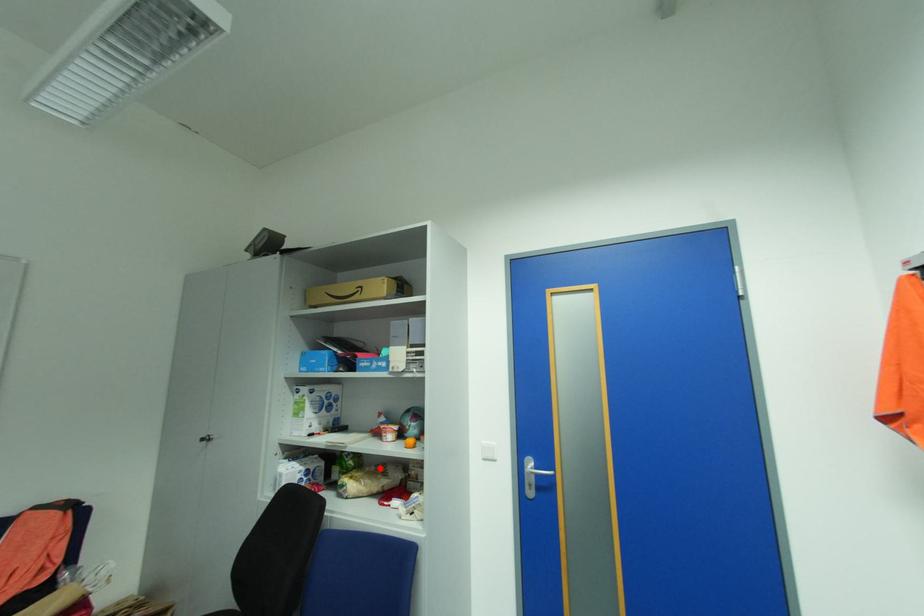
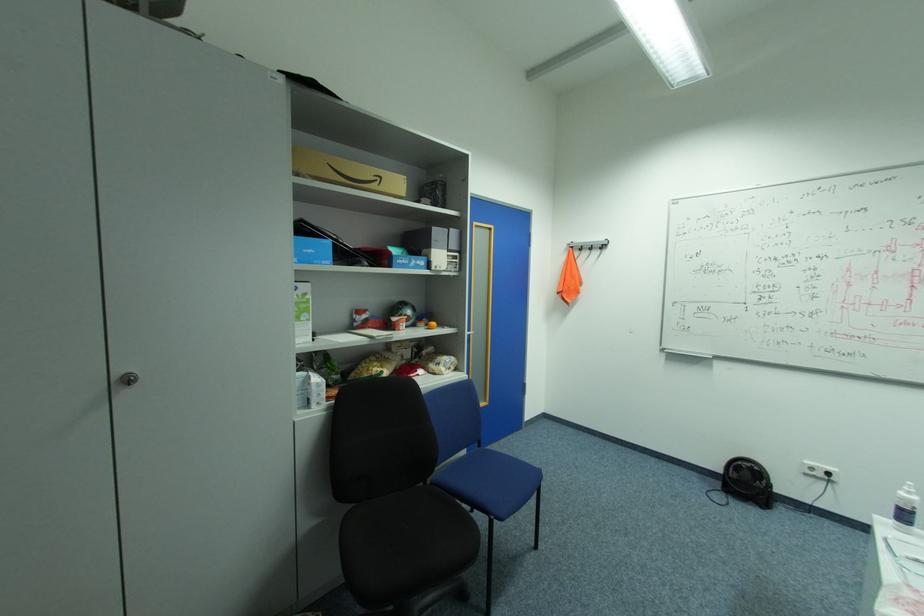
Find the pixel in the second image that matches the highlighted location in the first image.

(380, 358)